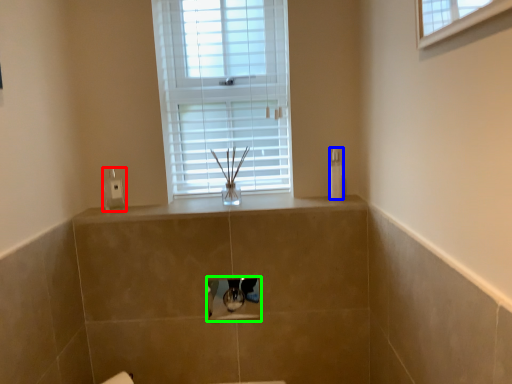
Question: Which object is positioned farthest from soap dispenser (highlighted by a red box)? Select from toiletry (highlighted by a blue box) and medicine cabinet (highlighted by a green box).

Choices:
 (A) toiletry
 (B) medicine cabinet

Answer: (A)